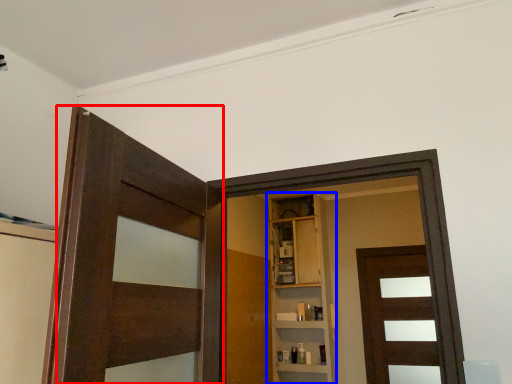
Question: Which object appears farthest to the camera in this image, door (highlighted by a red box) or cabinetry (highlighted by a blue box)?

Choices:
 (A) door
 (B) cabinetry

Answer: (B)